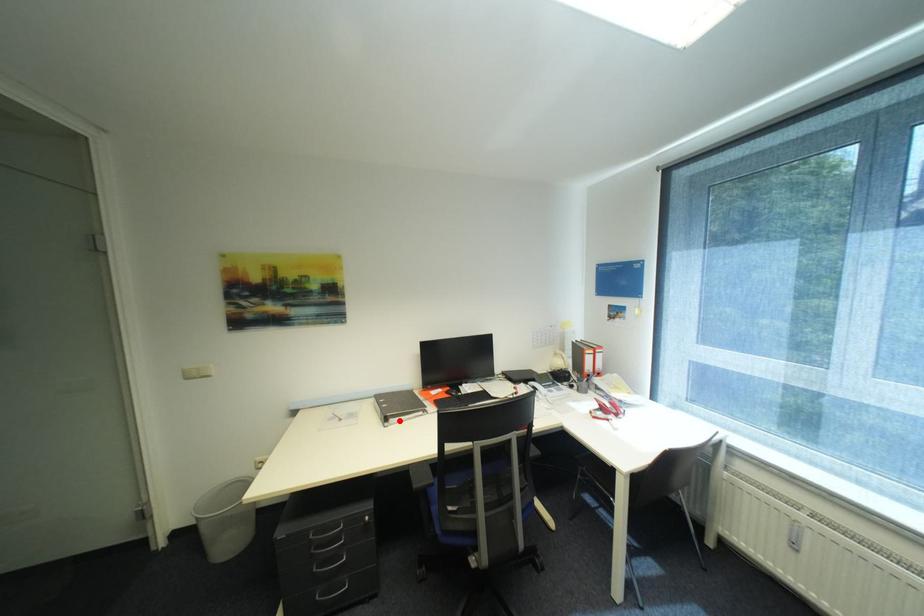
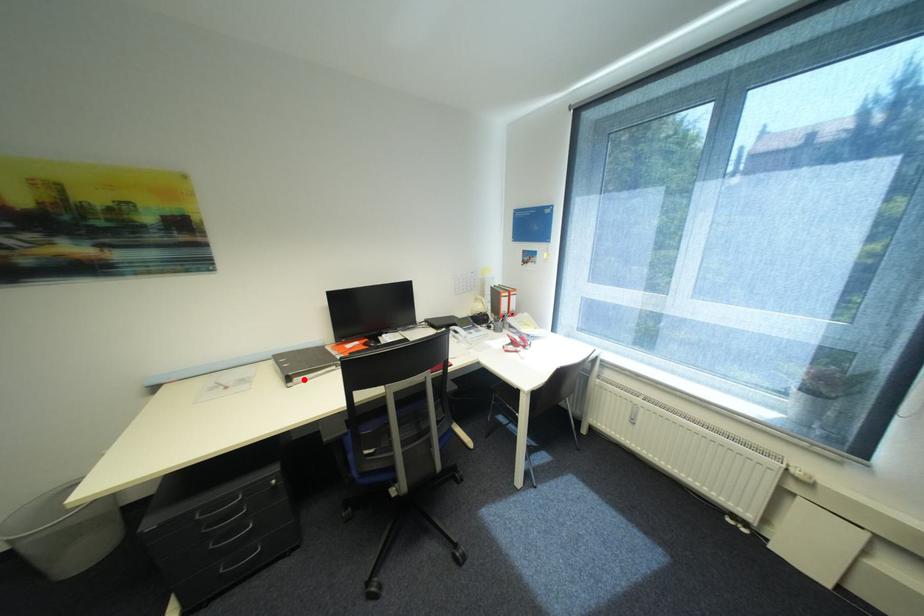
I am providing you with two images of the same scene from different viewpoints. A red point is marked on the first image and another point is marked on the second image. Is the red point in image1 aligned with the point shown in image2?

Yes